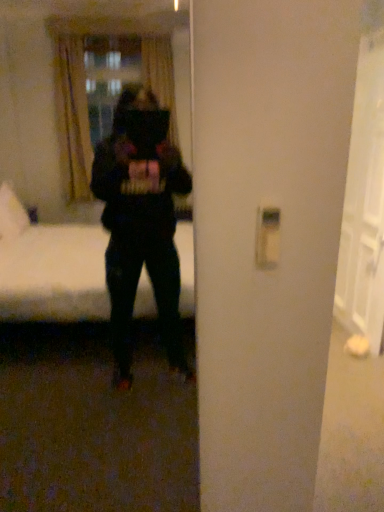
Question: Would you say black matte mirror at center is outside white plastic light switch at right?

Choices:
 (A) yes
 (B) no

Answer: (A)

Question: Does black matte mirror at center touch white plastic light switch at right?

Choices:
 (A) no
 (B) yes

Answer: (A)

Question: Considering the relative sizes of black matte mirror at center and white plastic light switch at right in the image provided, is black matte mirror at center smaller than white plastic light switch at right?

Choices:
 (A) no
 (B) yes

Answer: (A)

Question: Can you confirm if black matte mirror at center is taller than white plastic light switch at right?

Choices:
 (A) no
 (B) yes

Answer: (B)

Question: Is the position of black matte mirror at center less distant than that of white plastic light switch at right?

Choices:
 (A) yes
 (B) no

Answer: (A)

Question: Considering the relative positions of black matte mirror at center and white plastic light switch at right in the image provided, is black matte mirror at center to the right of white plastic light switch at right from the viewer's perspective?

Choices:
 (A) no
 (B) yes

Answer: (A)

Question: Considering the relative sizes of white glossy door at right and white plastic light switch at right in the image provided, is white glossy door at right bigger than white plastic light switch at right?

Choices:
 (A) yes
 (B) no

Answer: (A)

Question: Does white glossy door at right have a greater height compared to white plastic light switch at right?

Choices:
 (A) no
 (B) yes

Answer: (B)

Question: Considering the relative sizes of white glossy door at right and white plastic light switch at right in the image provided, is white glossy door at right wider than white plastic light switch at right?

Choices:
 (A) yes
 (B) no

Answer: (A)

Question: Is white glossy door at right next to white plastic light switch at right?

Choices:
 (A) yes
 (B) no

Answer: (B)

Question: Is white glossy door at right not within white plastic light switch at right?

Choices:
 (A) yes
 (B) no

Answer: (A)

Question: Is white glossy door at right not close to white plastic light switch at right?

Choices:
 (A) no
 (B) yes

Answer: (B)

Question: Does white glossy door at right have a lesser height compared to black matte mirror at center?

Choices:
 (A) no
 (B) yes

Answer: (A)